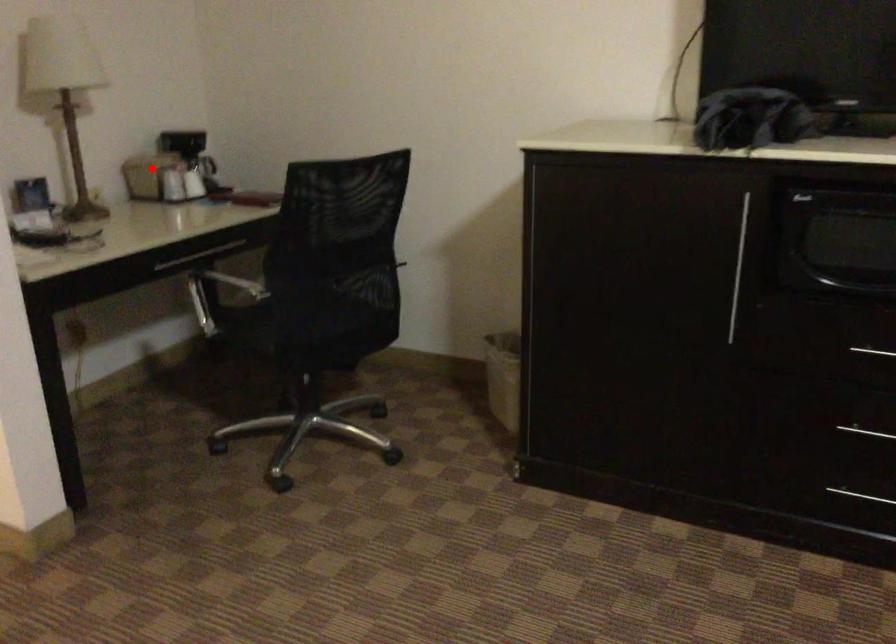
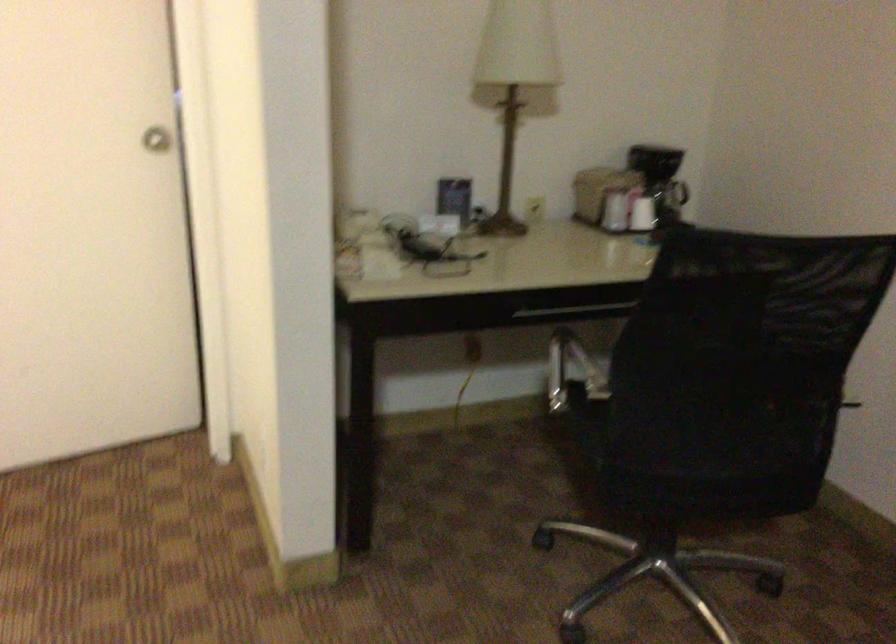
Find the pixel in the second image that matches the highlighted location in the first image.

(599, 190)